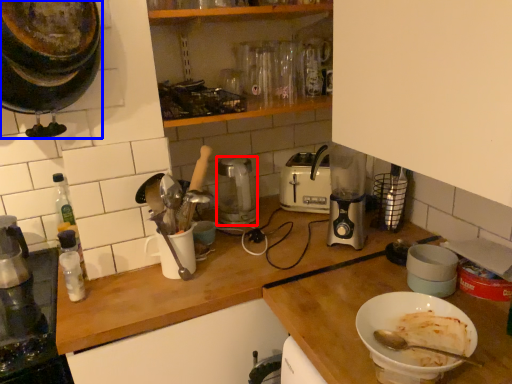
Question: Which of the following is the closest to the observer, kitchen appliance (highlighted by a red box) or kitchen appliance (highlighted by a blue box)?

Choices:
 (A) kitchen appliance
 (B) kitchen appliance

Answer: (B)